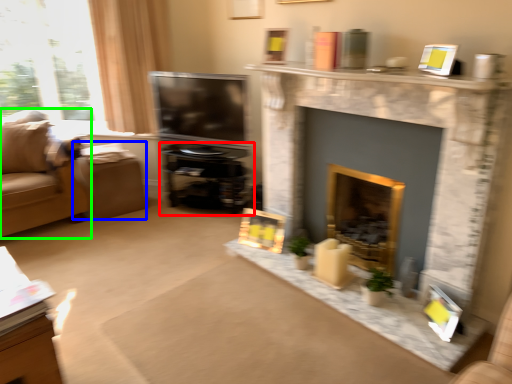
Question: Considering the real-world distances, which object is farthest from entertainment center (highlighted by a red box)? footrest (highlighted by a blue box) or studio couch (highlighted by a green box)?

Choices:
 (A) footrest
 (B) studio couch

Answer: (B)